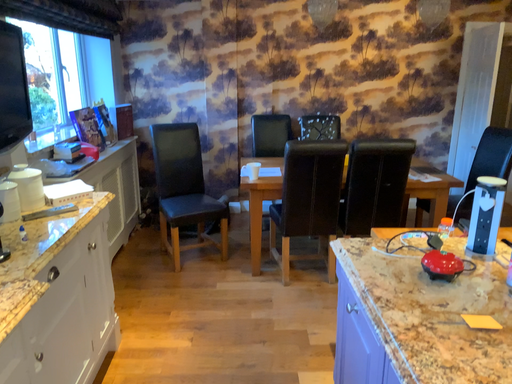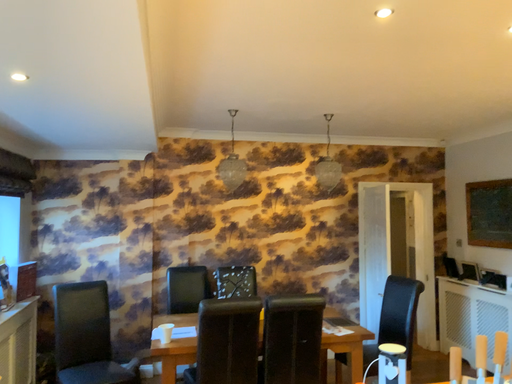
Question: How did the camera likely rotate when shooting the video?

Choices:
 (A) rotated right
 (B) rotated left

Answer: (A)